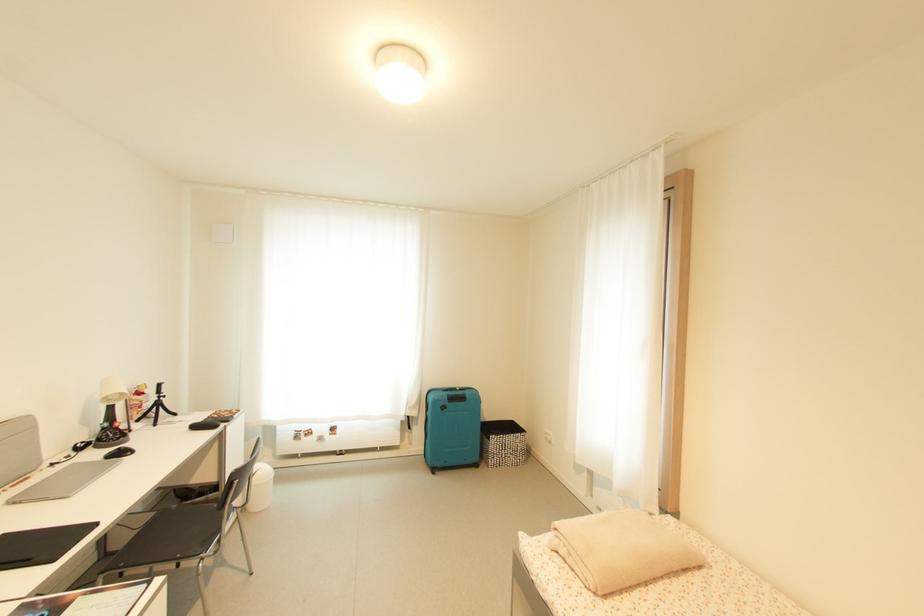
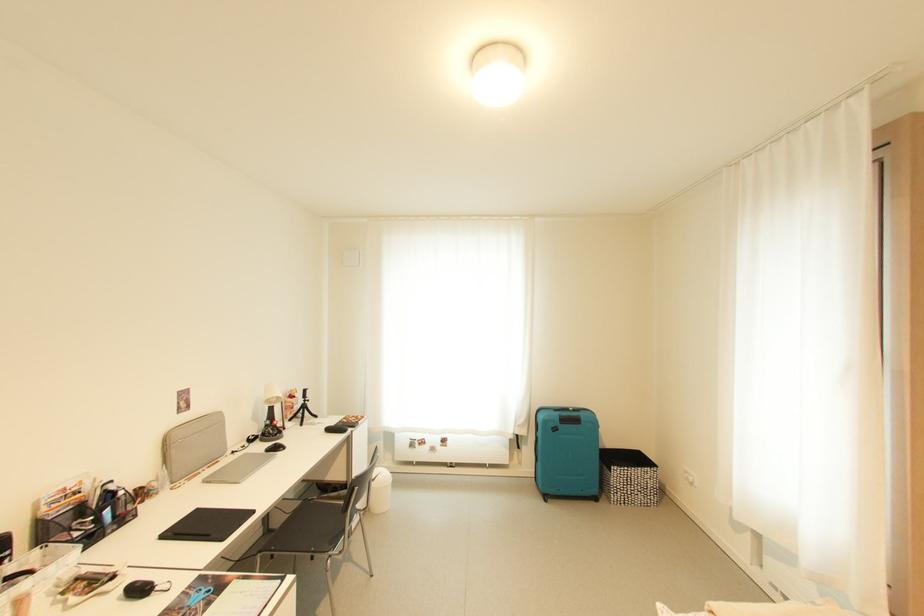
In the second image, find the point that corresponds to point (127, 455) in the first image.

(282, 450)